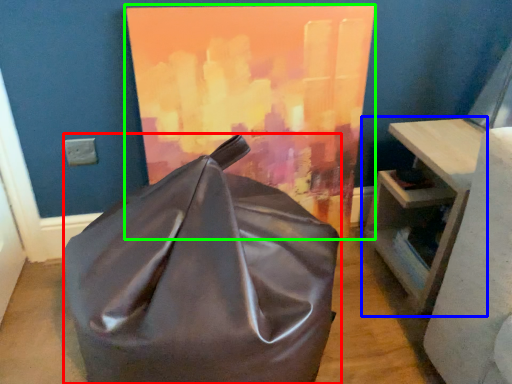
Question: Which object is the closest to the furniture (highlighted by a red box)? Choose among these: table (highlighted by a blue box) or oil painting (highlighted by a green box).

Choices:
 (A) table
 (B) oil painting

Answer: (B)